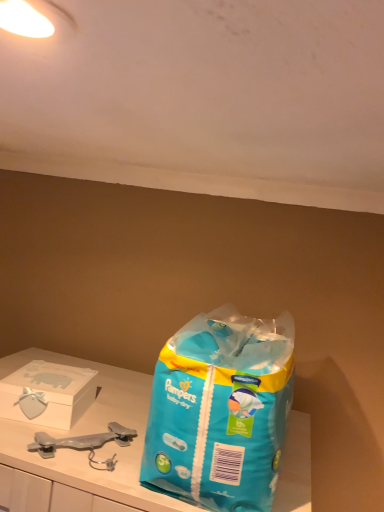
Question: Is matte white box at left facing away from blue plastic bag at center?

Choices:
 (A) no
 (B) yes

Answer: (A)

Question: Considering the relative sizes of matte white box at left and blue plastic bag at center in the image provided, is matte white box at left shorter than blue plastic bag at center?

Choices:
 (A) no
 (B) yes

Answer: (B)

Question: Does matte white box at left have a greater width compared to blue plastic bag at center?

Choices:
 (A) yes
 (B) no

Answer: (B)

Question: From the image's perspective, is matte white box at left beneath blue plastic bag at center?

Choices:
 (A) no
 (B) yes

Answer: (B)

Question: From a real-world perspective, is matte white box at left on blue plastic bag at center?

Choices:
 (A) yes
 (B) no

Answer: (B)

Question: Is blue plastic bag at center located within matte white box at left?

Choices:
 (A) yes
 (B) no

Answer: (B)

Question: Is blue plastic bag at center positioned with its back to matte white box at left?

Choices:
 (A) yes
 (B) no

Answer: (B)

Question: From a real-world perspective, does blue plastic bag at center stand above matte white box at left?

Choices:
 (A) no
 (B) yes

Answer: (B)

Question: Is blue plastic bag at center positioned behind matte white box at left?

Choices:
 (A) no
 (B) yes

Answer: (A)

Question: Would you say blue plastic bag at center contains matte white box at left?

Choices:
 (A) yes
 (B) no

Answer: (B)

Question: Is blue plastic bag at center not near matte white box at left?

Choices:
 (A) no
 (B) yes

Answer: (A)

Question: Can you confirm if blue plastic bag at center is shorter than matte white box at left?

Choices:
 (A) yes
 (B) no

Answer: (B)

Question: Is blue plastic bag at center inside the boundaries of matte white box at left, or outside?

Choices:
 (A) outside
 (B) inside

Answer: (A)